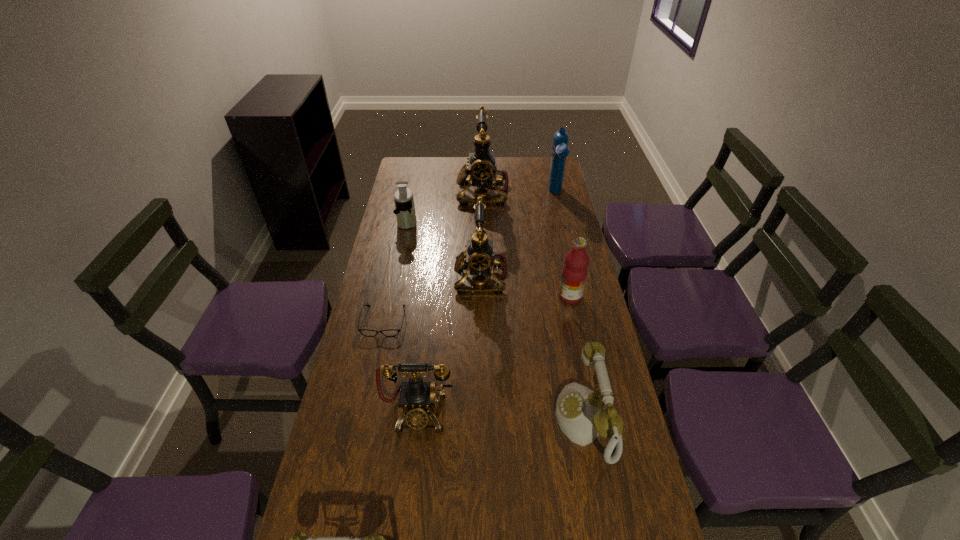
The height and width of the screenshot is (540, 960). Find the location of `juicer at the left edge`. juicer at the left edge is located at coordinates (405, 212).

Locate an element on the screen. Image resolution: width=960 pixels, height=540 pixels. spectacles that is at the left edge is located at coordinates (365, 332).

Image resolution: width=960 pixels, height=540 pixels. I want to click on shampoo located at the right edge, so click(x=560, y=150).

Identify the location of fruit juice present at the right edge. [574, 272].

I want to click on telephone situated at the right edge, so click(x=581, y=414).

In the image, there is a desktop. Identify the location of vacant region at the far edge. Image resolution: width=960 pixels, height=540 pixels. (508, 176).

In the image, there is a desktop. Where is `vacant space at the right edge`? vacant space at the right edge is located at coordinates (592, 308).

In the image, there is a desktop. Identify the location of free space at the far left corner. (420, 173).

You are a GUI agent. You are given a task and a screenshot of the screen. Output one action in this format:
    pyautogui.click(x=<x>, y=<y>)
    Task: Click on the vacant space at the far right corner of the desktop
    The image size is (960, 540).
    Given the screenshot: What is the action you would take?
    pyautogui.click(x=537, y=160)

This screenshot has height=540, width=960. Find the location of `vacant area that lies between the juicer and the second tallest telephone`. vacant area that lies between the juicer and the second tallest telephone is located at coordinates (444, 249).